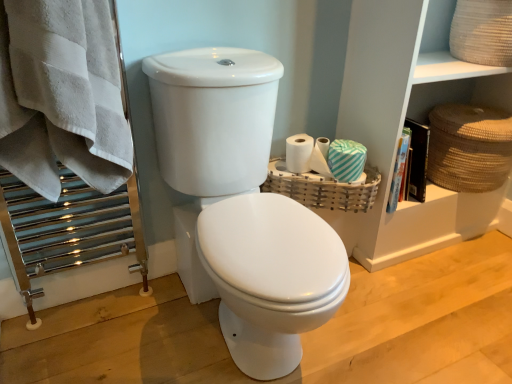
Where is `free spot below white cotton towel at left (from a real-world perspective)`? free spot below white cotton towel at left (from a real-world perspective) is located at coordinates (125, 322).